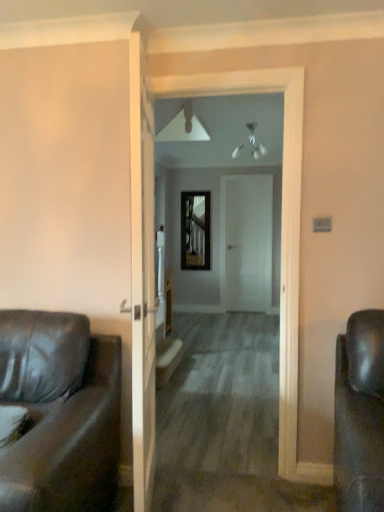
Image resolution: width=384 pixels, height=512 pixels. What do you see at coordinates (195, 230) in the screenshot?
I see `metallic reflective mirror at center` at bounding box center [195, 230].

Where is `matte black leather couch at left`? matte black leather couch at left is located at coordinates (60, 413).

I want to click on smooth wooden floor at center, so click(282, 219).

Who is smaller, white matte door at center or wooden at center?

Smaller between the two is wooden at center.

Can you see white matte door at center touching wooden at center?

No, white matte door at center is not next to wooden at center.

Is white matte door at center wider than wooden at center?

In fact, white matte door at center might be narrower than wooden at center.

Considering the positions of objects white matte door at center and wooden at center in the image provided, who is behind, white matte door at center or wooden at center?

white matte door at center is more distant.

Is smooth wooden floor at center facing towards wooden at center?

No, smooth wooden floor at center is not turned towards wooden at center.

Locate an element on the screen. stairwell below the smooth wooden floor at center (from the image's perspective) is located at coordinates (167, 359).

From their relative heights in the image, would you say smooth wooden floor at center is taller or shorter than wooden at center?

smooth wooden floor at center is taller than wooden at center.

Looking at this image, is smooth wooden floor at center at the right side of wooden at center?

Indeed, smooth wooden floor at center is positioned on the right side of wooden at center.

Is metallic reflective mirror at center further to the viewer compared to smooth wooden floor at center?

That is True.

Looking at this image, considering the positions of objects metallic reflective mirror at center and smooth wooden floor at center in the image provided, who is more to the right, metallic reflective mirror at center or smooth wooden floor at center?

From the viewer's perspective, smooth wooden floor at center appears more on the right side.

Can you confirm if metallic reflective mirror at center is bigger than smooth wooden floor at center?

Yes, metallic reflective mirror at center is bigger than smooth wooden floor at center.

Are metallic reflective mirror at center and smooth wooden floor at center beside each other?

metallic reflective mirror at center and smooth wooden floor at center are not in contact.

From a real-world perspective, is metallic reflective mirror at center physically below white matte door at center?

No.

Does metallic reflective mirror at center appear on the right side of white matte door at center?

No, metallic reflective mirror at center is not to the right of white matte door at center.

Would you say metallic reflective mirror at center is inside or outside white matte door at center?

metallic reflective mirror at center is not enclosed by white matte door at center.

Which point is more forward, (201,248) or (175,353)?

Point (175,353)

Is metallic reflective mirror at center inside the boundaries of wooden at center, or outside?

metallic reflective mirror at center is not enclosed by wooden at center.

Which object is closer to the camera taking this photo, metallic reflective mirror at center or wooden at center?

Positioned in front is wooden at center.

How many degrees apart are the facing directions of metallic reflective mirror at center and wooden at center?

metallic reflective mirror at center and wooden at center are facing 84 degrees away from each other.

Is smooth wooden floor at center outside of white matte door at center?

Yes, smooth wooden floor at center is outside of white matte door at center.

From the image's perspective, is smooth wooden floor at center above or below white matte door at center?

From the image's perspective, smooth wooden floor at center appears below white matte door at center.

Is smooth wooden floor at center directly adjacent to white matte door at center?

No, smooth wooden floor at center is not next to white matte door at center.

Does matte black leather couch at left turn towards white matte door at center?

No, matte black leather couch at left does not turn towards white matte door at center.

Considering the sizes of matte black leather couch at left and white matte door at center in the image, is matte black leather couch at left wider or thinner than white matte door at center?

In the image, matte black leather couch at left appears to be wider than white matte door at center.

How different are the orientations of matte black leather couch at left and white matte door at center in degrees?

0.868 degrees separate the facing orientations of matte black leather couch at left and white matte door at center.

You are a GUI agent. You are given a task and a screenshot of the screen. Output one action in this format:
    pyautogui.click(x=<x>, y=<y>)
    Task: Click on the door above the wooden at center (from the image's perspective)
    This screenshot has height=512, width=384.
    Given the screenshot: What is the action you would take?
    pyautogui.click(x=247, y=243)

I want to click on corridor above the wooden at center (from a real-world perspective), so click(282, 219).

From the image, which object appears to be nearer to matte black leather couch at left, metallic reflective mirror at center or wooden at center?

Among the two, wooden at center is located nearer to matte black leather couch at left.

Based on their spatial positions, is white matte door at center or metallic reflective mirror at center further from matte black leather couch at left?

metallic reflective mirror at center is positioned further to the anchor matte black leather couch at left.

Estimate the real-world distances between objects in this image. Which object is closer to white matte door at center, matte black leather couch at left or metallic reflective mirror at center?

Based on the image, metallic reflective mirror at center appears to be nearer to white matte door at center.

Which object lies nearer to the anchor point white matte door at center, smooth wooden floor at center or wooden at center?

wooden at center lies closer to white matte door at center than the other object.

When comparing their distances from smooth wooden floor at center, does wooden at center or white matte door at center seem closer?

The object closer to smooth wooden floor at center is wooden at center.

Looking at the image, which one is located closer to white matte door at center, matte black leather couch at left or smooth wooden floor at center?

smooth wooden floor at center lies closer to white matte door at center than the other object.

Looking at the image, which one is located further to smooth wooden floor at center, white matte door at center or metallic reflective mirror at center?

metallic reflective mirror at center is positioned further to the anchor smooth wooden floor at center.

When comparing their distances from smooth wooden floor at center, does metallic reflective mirror at center or wooden at center seem further?

The object further to smooth wooden floor at center is metallic reflective mirror at center.

At what (x,y) coordinates should I click in order to perform the action: click on corridor between matte black leather couch at left and metallic reflective mirror at center from front to back. Please return your answer as a coordinate pair (x, y). This screenshot has height=512, width=384. Looking at the image, I should click on (282, 219).

At what (x,y) coordinates should I click in order to perform the action: click on door positioned between smooth wooden floor at center and metallic reflective mirror at center from near to far. Please return your answer as a coordinate pair (x, y). The height and width of the screenshot is (512, 384). Looking at the image, I should click on (247, 243).

This screenshot has height=512, width=384. I want to click on door between matte black leather couch at left and metallic reflective mirror at center in the front-back direction, so click(247, 243).

At what (x,y) coordinates should I click in order to perform the action: click on stairwell between smooth wooden floor at center and metallic reflective mirror at center from front to back. Please return your answer as a coordinate pair (x, y). This screenshot has width=384, height=512. Looking at the image, I should click on (167, 359).